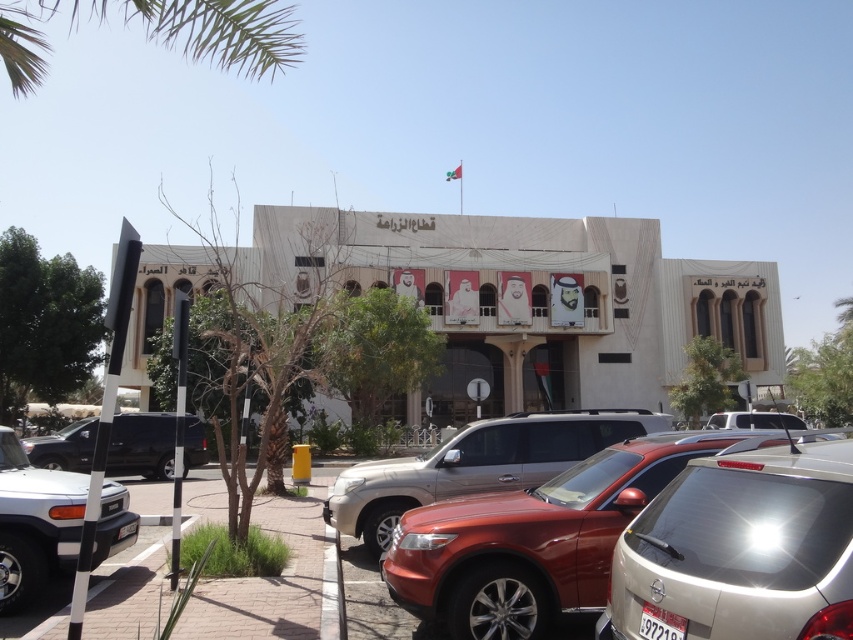
Question: Is green leafy palm at upper left bigger than shiny black suv at lower left?

Choices:
 (A) yes
 (B) no

Answer: (A)

Question: Estimate the real-world distances between objects in this image. Which object is farther from the metallic silver sedan at lower right?

Choices:
 (A) green leafy palm at upper left
 (B) silver metallic suv at lower left
 (C) metallic silver suv at center
 (D) white matte car at center

Answer: (D)

Question: Which of the following is the farthest from the observer?

Choices:
 (A) green leafy palm at upper left
 (B) metallic silver sedan at lower right

Answer: (A)

Question: Is metallic silver sedan at lower right above silver metallic suv at lower left?

Choices:
 (A) no
 (B) yes

Answer: (B)

Question: Does silver metallic suv at lower left appear under white matte car at center?

Choices:
 (A) yes
 (B) no

Answer: (B)

Question: Which of the following is the farthest from the observer?

Choices:
 (A) (123, 448)
 (B) (38, 515)

Answer: (A)